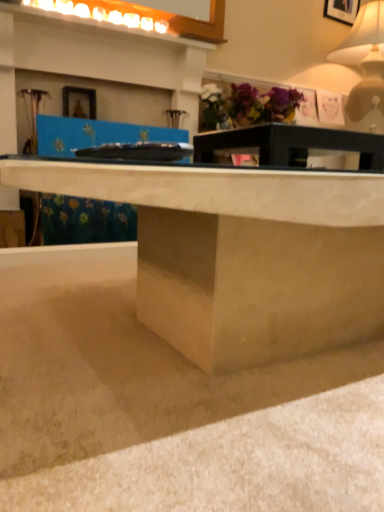
The image size is (384, 512). What do you see at coordinates (79, 102) in the screenshot?
I see `wooden picture frame at upper center` at bounding box center [79, 102].

At what (x,y) coordinates should I click in order to perform the action: click on smooth concrete at lower center. Please return your answer as a coordinate pair (x, y). This screenshot has width=384, height=512. Looking at the image, I should click on (233, 463).

What do you see at coordinates (233, 463) in the screenshot? Image resolution: width=384 pixels, height=512 pixels. I see `smooth concrete at lower center` at bounding box center [233, 463].

In the scene shown: In order to face matte white table lamp at upper right, should I rotate leftwards or rightwards?

A 23.172 degree turn to the right will do.

Measure the distance between point (363, 91) and camera.

8.92 feet.

Describe the element at coordinates (290, 143) in the screenshot. The width and height of the screenshot is (384, 512). I see `matte black table at center` at that location.

What do you see at coordinates (242, 254) in the screenshot? I see `matte concrete desk at center` at bounding box center [242, 254].

What are the coordinates of `wooden picture frame at upper center` in the screenshot? It's located at (79, 102).

How far apart are matte white table lamp at upper right and matte concrete desk at center?

matte white table lamp at upper right is 6.93 feet from matte concrete desk at center.

Looking at this image, what's the angular difference between matte white table lamp at upper right and matte concrete desk at center's facing directions?

They differ by 0.511 degrees in their facing directions.

Is the position of matte white table lamp at upper right more distant than that of matte concrete desk at center?

Yes, the depth of matte white table lamp at upper right is greater than that of matte concrete desk at center.

Considering the relative sizes of matte white table lamp at upper right and matte concrete desk at center in the image provided, is matte white table lamp at upper right smaller than matte concrete desk at center?

Indeed, matte white table lamp at upper right has a smaller size compared to matte concrete desk at center.

Is smooth concrete at lower center not close to matte purple flowers at upper center?

smooth concrete at lower center is positioned a significant distance from matte purple flowers at upper center.

Does smooth concrete at lower center turn towards matte purple flowers at upper center?

No, smooth concrete at lower center is not oriented towards matte purple flowers at upper center.

How different are the orientations of smooth concrete at lower center and matte purple flowers at upper center in degrees?

They differ by 89.4 degrees in their facing directions.

Is matte concrete desk at center in contact with matte purple flowers at upper center?

matte concrete desk at center and matte purple flowers at upper center are clearly separated.

From the picture: Does matte concrete desk at center have a greater width compared to matte purple flowers at upper center?

Yes.

Is matte purple flowers at upper center a part of matte concrete desk at center?

That's incorrect, matte purple flowers at upper center is not inside matte concrete desk at center.

Considering the relative positions of matte concrete desk at center and matte purple flowers at upper center in the image provided, is matte concrete desk at center to the right of matte purple flowers at upper center from the viewer's perspective?

No.

Which is further, [132,452] or [347,45]?

The point [347,45] is farther from the camera.

Considering the relative positions of smooth concrete at lower center and matte white table lamp at upper right in the image provided, is smooth concrete at lower center behind matte white table lamp at upper right?

That is False.

In the scene shown: Which of these two, smooth concrete at lower center or matte white table lamp at upper right, is smaller?

smooth concrete at lower center.

Between smooth concrete at lower center and matte white table lamp at upper right, which one has larger width?

Wider between the two is smooth concrete at lower center.

From a real-world perspective, is wooden picture frame at upper center physically below matte white table lamp at upper right?

Correct, in the physical world, wooden picture frame at upper center is lower than matte white table lamp at upper right.

Does wooden picture frame at upper center have a greater height compared to matte white table lamp at upper right?

No.

Would you consider wooden picture frame at upper center to be distant from matte white table lamp at upper right?

wooden picture frame at upper center is positioned a significant distance from matte white table lamp at upper right.

In order to click on concrete beneath the matte white table lamp at upper right (from a real-world perspective) in this screenshot , I will do `click(233, 463)`.

From a real-world perspective, is matte white table lamp at upper right positioned over smooth concrete at lower center based on gravity?

Indeed, from a real-world perspective, matte white table lamp at upper right stands above smooth concrete at lower center.

Based on the photo, which of these two, matte white table lamp at upper right or smooth concrete at lower center, is bigger?

matte white table lamp at upper right is bigger.

Is matte concrete desk at center positioned before matte black table at center?

Yes, it is in front of matte black table at center.

Considering the positions of objects matte concrete desk at center and matte black table at center in the image provided, who is more to the left, matte concrete desk at center or matte black table at center?

From the viewer's perspective, matte concrete desk at center appears more on the left side.

Would you say matte concrete desk at center contains matte black table at center?

That's incorrect, matte black table at center is not inside matte concrete desk at center.

Where is `table lamp that appears above the matte concrete desk at center (from a real-world perspective)`? The width and height of the screenshot is (384, 512). table lamp that appears above the matte concrete desk at center (from a real-world perspective) is located at coordinates (365, 62).

At what (x,y) coordinates should I click in order to perform the action: click on concrete lying below the matte purple flowers at upper center (from the image's perspective). Please return your answer as a coordinate pair (x, y). Looking at the image, I should click on (233, 463).

Based on their spatial positions, is wooden picture frame at upper center or smooth concrete at lower center further from matte purple flowers at upper center?

smooth concrete at lower center lies further to matte purple flowers at upper center than the other object.

Which object lies further to the anchor point matte black table at center, wooden picture frame at upper center or smooth concrete at lower center?

Among the two, wooden picture frame at upper center is located further to matte black table at center.

When comparing their distances from smooth concrete at lower center, does wooden picture frame at upper center or matte black table at center seem closer?

Based on the image, matte black table at center appears to be nearer to smooth concrete at lower center.

From the image, which object appears to be farther from wooden picture frame at upper center, matte purple flowers at upper center or matte concrete desk at center?

matte concrete desk at center lies further to wooden picture frame at upper center than the other object.

Estimate the real-world distances between objects in this image. Which object is closer to wooden picture frame at upper center, matte black table at center or matte purple flowers at upper center?

The object closer to wooden picture frame at upper center is matte purple flowers at upper center.

Which object lies nearer to the anchor point smooth concrete at lower center, matte purple flowers at upper center or wooden picture frame at upper center?

wooden picture frame at upper center is positioned closer to the anchor smooth concrete at lower center.

From the image, which object appears to be farther from matte purple flowers at upper center, smooth concrete at lower center or matte white table lamp at upper right?

The object further to matte purple flowers at upper center is smooth concrete at lower center.

Looking at the image, which one is located closer to matte concrete desk at center, smooth concrete at lower center or wooden picture frame at upper center?

smooth concrete at lower center is positioned closer to the anchor matte concrete desk at center.

You are a GUI agent. You are given a task and a screenshot of the screen. Output one action in this format:
    pyautogui.click(x=<x>, y=<y>)
    Task: Click on the desk positioned between smooth concrete at lower center and wooden picture frame at upper center from near to far
    
    Given the screenshot: What is the action you would take?
    pyautogui.click(x=242, y=254)

Where is `picture frame between smooth concrete at lower center and matte purple flowers at upper center in the front-back direction`? picture frame between smooth concrete at lower center and matte purple flowers at upper center in the front-back direction is located at coordinates (79, 102).

Locate an element on the screen. Image resolution: width=384 pixels, height=512 pixels. table between wooden picture frame at upper center and matte white table lamp at upper right is located at coordinates (290, 143).

Locate an element on the screen. Image resolution: width=384 pixels, height=512 pixels. table positioned between smooth concrete at lower center and matte white table lamp at upper right from near to far is located at coordinates pos(290,143).